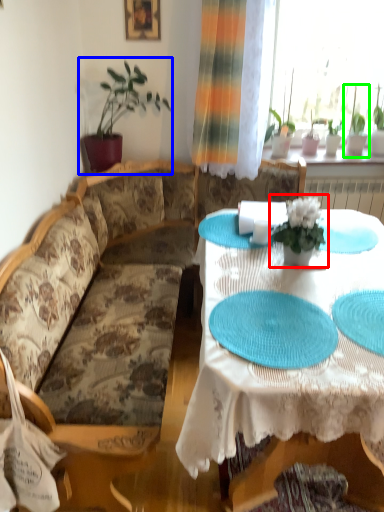
Question: Which object is the farthest from houseplant (highlighted by a red box)? Choose among these: houseplant (highlighted by a blue box) or houseplant (highlighted by a green box).

Choices:
 (A) houseplant
 (B) houseplant

Answer: (B)